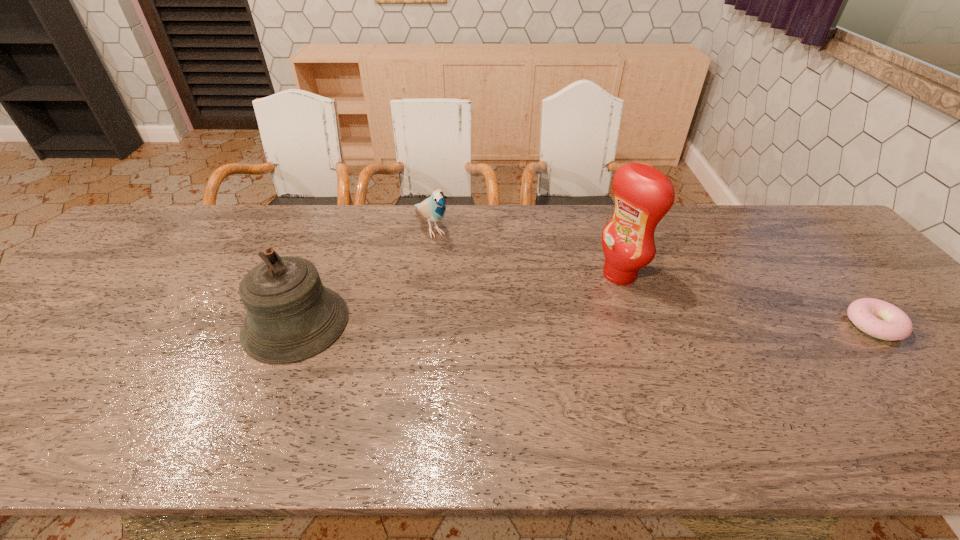
I want to click on free space between the farthest object and the third object from left to right, so click(x=525, y=251).

The image size is (960, 540). I want to click on vacant region between the bell and the tallest object, so click(x=458, y=299).

Where is `free spot between the leftmost object and the bird`? This screenshot has height=540, width=960. free spot between the leftmost object and the bird is located at coordinates (364, 275).

Where is `free spot between the doughnut and the leftmost object`? This screenshot has height=540, width=960. free spot between the doughnut and the leftmost object is located at coordinates (585, 324).

Where is `object that stands as the third closest to the third shortest object`? object that stands as the third closest to the third shortest object is located at coordinates (877, 318).

The height and width of the screenshot is (540, 960). I want to click on object that is the third closest one to the third object from left to right, so (x=291, y=316).

I want to click on vacant space that satisfies the following two spatial constraints: 1. on the front side of the farthest object; 2. on the right side of the shortest object, so click(x=418, y=325).

Find the location of `vacant space that satisfies the following two spatial constraints: 1. on the front side of the rightmost object; 2. on the left side of the bell`. vacant space that satisfies the following two spatial constraints: 1. on the front side of the rightmost object; 2. on the left side of the bell is located at coordinates (295, 325).

Locate an element on the screen. This screenshot has width=960, height=540. vacant region that satisfies the following two spatial constraints: 1. on the back side of the bell; 2. on the right side of the condiment is located at coordinates (316, 274).